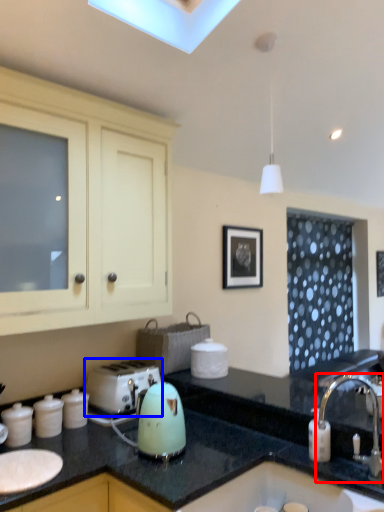
Question: Which object appears farthest to the camera in this image, tap (highlighted by a red box) or toaster (highlighted by a blue box)?

Choices:
 (A) tap
 (B) toaster

Answer: (B)